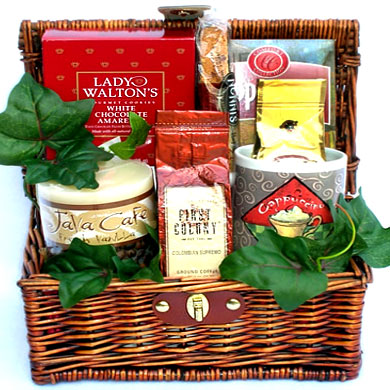
Where is `box`? This screenshot has width=390, height=390. box is located at coordinates (168, 71).